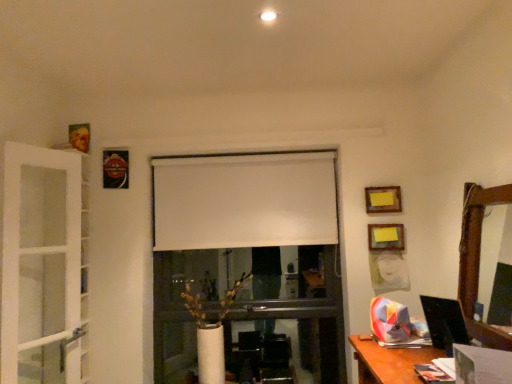
Question: Considering the relative sizes of white matte curtain at center and yellow paper at upper center, the 2th picture frame when ordered from top to bottom, in the image provided, is white matte curtain at center bigger than yellow paper at upper center, the 2th picture frame when ordered from top to bottom,?

Choices:
 (A) yes
 (B) no

Answer: (A)

Question: Is white matte curtain at center behind yellow paper at upper center, which is the third picture frame in bottom-to-top order?

Choices:
 (A) yes
 (B) no

Answer: (A)

Question: Is white matte curtain at center completely or partially outside of yellow paper at upper center, the 3th picture frame when ordered from right to left?

Choices:
 (A) no
 (B) yes

Answer: (B)

Question: Does white matte curtain at center appear on the right side of yellow paper at upper center, which is the third picture frame in bottom-to-top order?

Choices:
 (A) yes
 (B) no

Answer: (B)

Question: From a real-world perspective, is white matte curtain at center below yellow paper at upper center, the 2th picture frame when ordered from top to bottom?

Choices:
 (A) yes
 (B) no

Answer: (B)

Question: Would you say wooden picture frame at upper right, which is counted as the second picture frame, starting from the bottom, is inside or outside wooden frame mirror at right?

Choices:
 (A) inside
 (B) outside

Answer: (B)

Question: Considering the positions of wooden picture frame at upper right, the 3th picture frame positioned from the left, and wooden frame mirror at right in the image, is wooden picture frame at upper right, the 3th picture frame positioned from the left, taller or shorter than wooden frame mirror at right?

Choices:
 (A) short
 (B) tall

Answer: (A)

Question: In terms of width, does wooden picture frame at upper right, which is the 2th picture frame in right-to-left order, look wider or thinner when compared to wooden frame mirror at right?

Choices:
 (A) thin
 (B) wide

Answer: (A)

Question: From the image's perspective, is wooden picture frame at upper right, which is counted as the second picture frame, starting from the bottom, above or below wooden frame mirror at right?

Choices:
 (A) above
 (B) below

Answer: (B)

Question: Does point (240, 180) appear closer or farther from the camera than point (52, 254)?

Choices:
 (A) farther
 (B) closer

Answer: (A)

Question: In terms of height, does white matte curtain at center look taller or shorter compared to white glass screen door at left?

Choices:
 (A) tall
 (B) short

Answer: (B)

Question: Would you say white matte curtain at center is inside or outside white glass screen door at left?

Choices:
 (A) outside
 (B) inside

Answer: (A)

Question: From the image's perspective, is white matte curtain at center positioned above or below white glass screen door at left?

Choices:
 (A) above
 (B) below

Answer: (A)

Question: Is matte white picture frame at right, arranged as the 1th picture frame when viewed from the right, situated inside white matte curtain at center or outside?

Choices:
 (A) outside
 (B) inside

Answer: (A)

Question: Considering the positions of matte white picture frame at right, placed as the fourth picture frame when sorted from top to bottom, and white matte curtain at center in the image, is matte white picture frame at right, placed as the fourth picture frame when sorted from top to bottom, bigger or smaller than white matte curtain at center?

Choices:
 (A) small
 (B) big

Answer: (A)